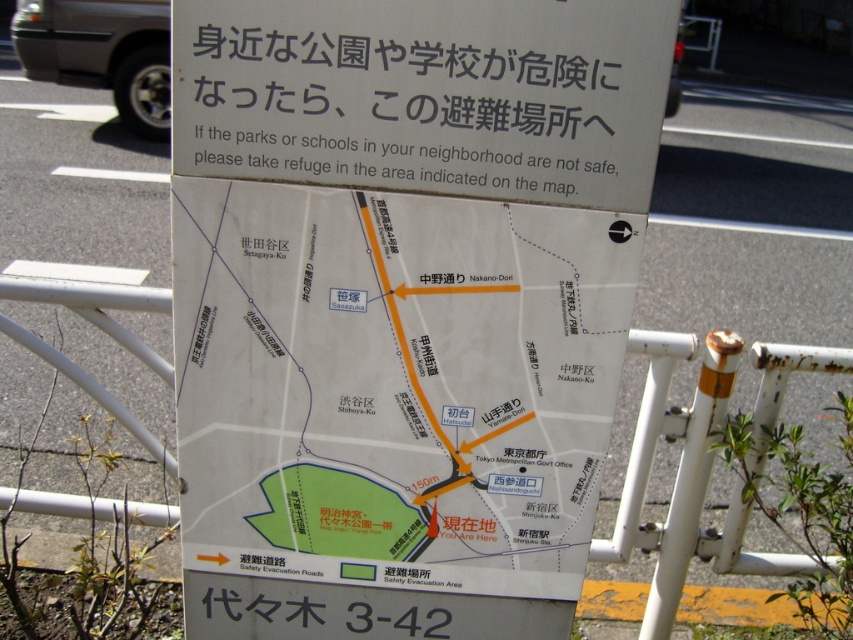
Question: Does white paper map at center appear under white paper sign at upper center?

Choices:
 (A) yes
 (B) no

Answer: (A)

Question: Is white paper sign at upper center positioned in front of rusty metal pole at right?

Choices:
 (A) no
 (B) yes

Answer: (B)

Question: Which object is closer to the camera taking this photo?

Choices:
 (A) white paper map at center
 (B) white paper sign at upper center

Answer: (B)

Question: Among these points, which one is farthest from the camera?

Choices:
 (A) pos(656,13)
 (B) pos(579,268)
 (C) pos(723,339)

Answer: (C)

Question: Which is nearer to the white paper sign at upper center?

Choices:
 (A) rusty metal pole at right
 (B) white paper map at center

Answer: (B)

Question: Is white paper sign at upper center smaller than rusty metal pole at right?

Choices:
 (A) yes
 (B) no

Answer: (A)